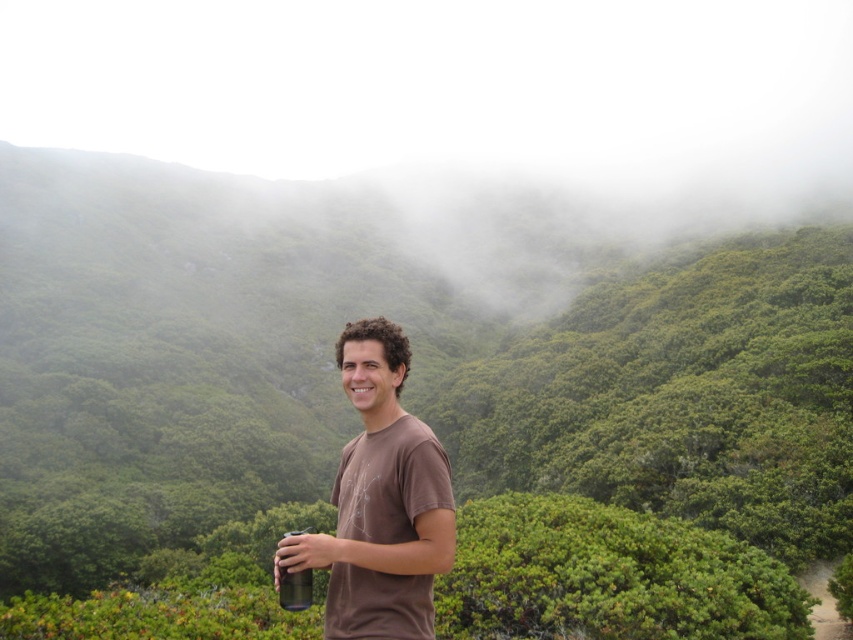
Question: Which object is farther from the camera taking this photo?

Choices:
 (A) metallic silver cup at lower center
 (B) brown cotton t-shirt at center

Answer: (A)

Question: Can you confirm if brown cotton t-shirt at center is positioned to the right of metallic silver cup at lower center?

Choices:
 (A) yes
 (B) no

Answer: (A)

Question: Which of the following is the closest to the observer?

Choices:
 (A) (351, 460)
 (B) (300, 589)

Answer: (B)

Question: Does brown cotton t-shirt at center appear under metallic silver cup at lower center?

Choices:
 (A) yes
 (B) no

Answer: (B)

Question: Is brown cotton t-shirt at center closer to camera compared to metallic silver cup at lower center?

Choices:
 (A) no
 (B) yes

Answer: (B)